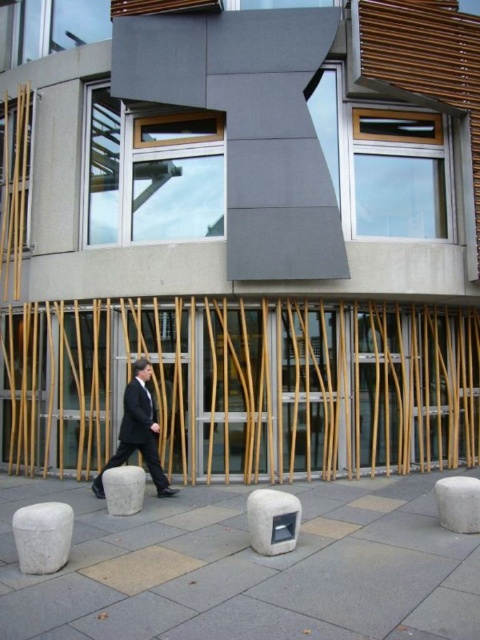
You are a visitor approaching the modern building and see the white stone stool at lower left and the white stone stool at lower center. Which stool is taller?

The white stone stool at lower center is taller than the white stone stool at lower left.

You are standing at the point with coordinates point (68, 506) and want to walk towards the entrance of the building. However, there is an obstacle located at point (124, 506). Will you need to move forward or backward to avoid the obstacle?

Since point (68, 506) is in front of point (124, 506), you are already ahead of the obstacle. Therefore, you can continue moving forward towards the entrance without needing to adjust your path.